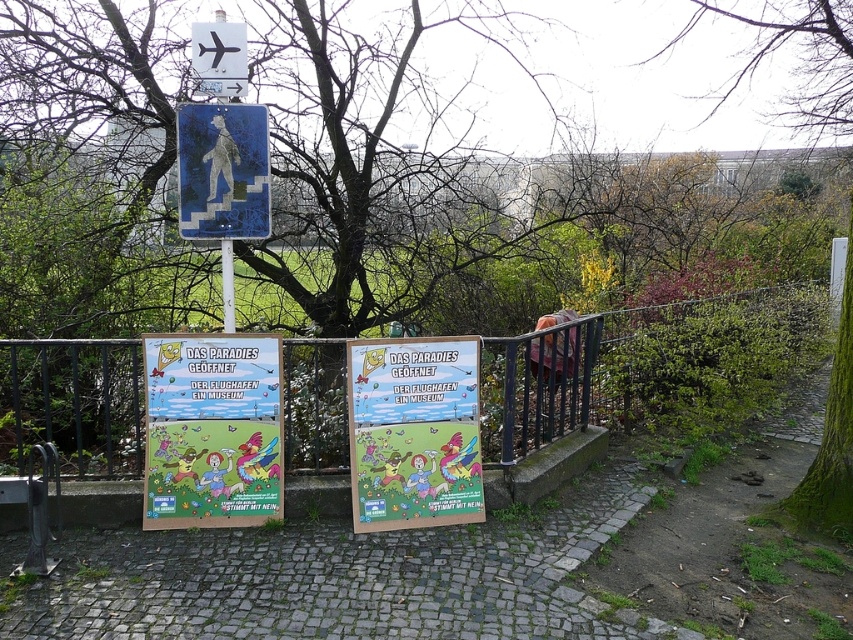
Which is behind, point (144, 538) or point (405, 436)?

Point (405, 436)

Is point (308, 616) farther from camera compared to point (421, 419)?

That is False.

Where is `cobblestone path at center`? cobblestone path at center is located at coordinates (334, 577).

Is green leafy tree at center to the left of blue painted pedestrian sign at center from the viewer's perspective?

Incorrect, green leafy tree at center is not on the left side of blue painted pedestrian sign at center.

Is green leafy tree at center closer to camera compared to blue painted pedestrian sign at center?

No, green leafy tree at center is behind blue painted pedestrian sign at center.

Measure the distance between point (293, 291) and camera.

They are 23.69 feet apart.

You are a GUI agent. You are given a task and a screenshot of the screen. Output one action in this format:
    pyautogui.click(x=<x>, y=<y>)
    Task: Click on the green leafy tree at center
    The image size is (853, 640).
    Given the screenshot: What is the action you would take?
    pyautogui.click(x=363, y=172)

Where is `cardboard poster at center`? cardboard poster at center is located at coordinates (212, 429).

Which is more to the left, cardboard poster at center or green mossy tree at upper right?

cardboard poster at center

Is point (204, 467) in front of point (836, 88)?

Yes, it is in front of point (836, 88).

Locate an element on the screen. The height and width of the screenshot is (640, 853). cardboard poster at center is located at coordinates (212, 429).